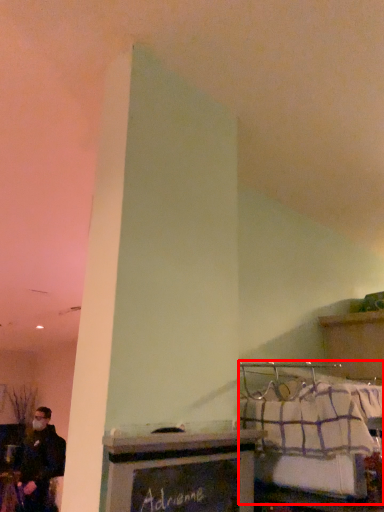
Question: In this image, where is bed (annotated by the red box) located relative to furniture?

Choices:
 (A) right
 (B) left

Answer: (A)